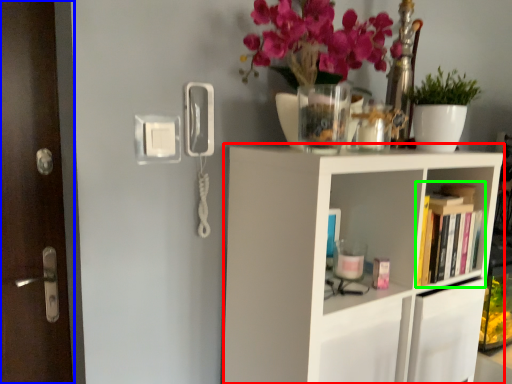
Question: Considering the real-world distances, which object is closest to shelf (highlighted by a red box)? door (highlighted by a blue box) or book (highlighted by a green box).

Choices:
 (A) door
 (B) book

Answer: (B)